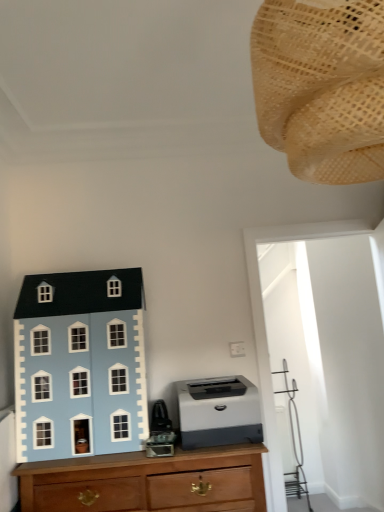
Question: Is point (74, 394) closer or farther from the camera than point (96, 508)?

Choices:
 (A) closer
 (B) farther

Answer: (B)

Question: Based on their positions, is light blue matte dollhouse at left, placed as the first toy when sorted from bottom to top, located to the left or right of wooden chest of drawers at lower left?

Choices:
 (A) right
 (B) left

Answer: (B)

Question: Which is farther from the woven beige lampshade at upper right, the second toy positioned from the back?

Choices:
 (A) gray matte printer at center
 (B) light blue matte dollhouse at left, acting as the 1th toy starting from the left
 (C) wooden chest of drawers at lower left

Answer: (C)

Question: Which of these objects is positioned farthest from the gray matte printer at center?

Choices:
 (A) light blue matte dollhouse at left, which appears as the second toy when viewed from the top
 (B) woven beige lampshade at upper right, which is counted as the first toy, starting from the right
 (C) wooden chest of drawers at lower left

Answer: (B)